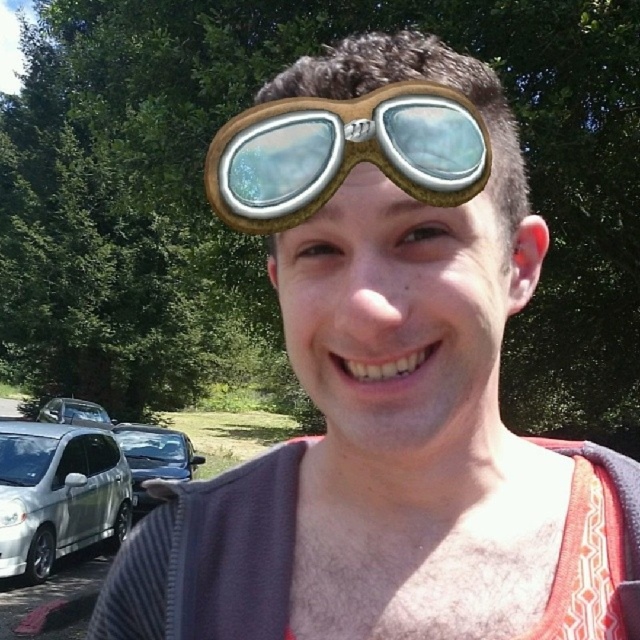
Question: Can you confirm if white matte car at lower left is thinner than white glossy car at lower left?

Choices:
 (A) no
 (B) yes

Answer: (B)

Question: Which point appears farthest from the camera in this image?

Choices:
 (A) (83, 404)
 (B) (323, 189)
 (C) (184, 481)
 (D) (13, 470)

Answer: (A)

Question: Among these objects, which one is nearest to the camera?

Choices:
 (A) brown leather goggles at center
 (B) white matte car at lower left

Answer: (A)

Question: Does brown leather goggles at center appear on the left side of white glossy car at lower left?

Choices:
 (A) yes
 (B) no

Answer: (B)

Question: Estimate the real-world distances between objects in this image. Which object is closer to the brown leather goggles at center?

Choices:
 (A) white matte car at lower left
 (B) white glossy car at lower left

Answer: (A)

Question: Observing the image, what is the correct spatial positioning of brown leather goggles at center in reference to shiny black car at lower left?

Choices:
 (A) right
 (B) left

Answer: (A)